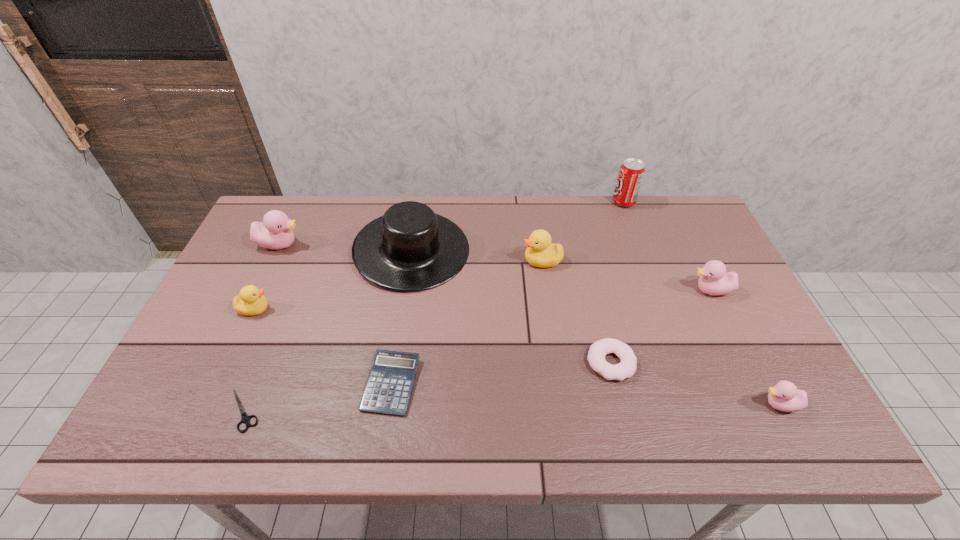
This screenshot has width=960, height=540. Identify the location of the third object from right to left. (631, 172).

The width and height of the screenshot is (960, 540). Find the location of `the farthest object`. the farthest object is located at coordinates (631, 172).

Locate an element on the screen. This screenshot has width=960, height=540. black dress hat is located at coordinates (410, 248).

Locate an element on the screen. Image resolution: width=960 pixels, height=540 pixels. the biggest pink duckling is located at coordinates (275, 232).

Find the location of a particular element. This screenshot has width=960, height=540. the farthest pink duckling is located at coordinates (275, 232).

The height and width of the screenshot is (540, 960). What are the coordinates of `the bigger yellow duckling` in the screenshot? It's located at (540, 253).

The image size is (960, 540). I want to click on the fifth object from right to left, so click(x=540, y=253).

What are the coordinates of `the second smallest pink duckling` in the screenshot? It's located at (714, 280).

Image resolution: width=960 pixels, height=540 pixels. I want to click on the nearer yellow duckling, so click(250, 301).

Where is `the smaller yellow duckling`? This screenshot has height=540, width=960. the smaller yellow duckling is located at coordinates (250, 301).